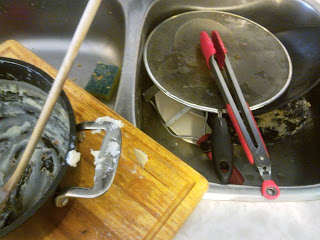
Identify the location of stainless steel sink. This screenshot has height=240, width=320. (50, 46).